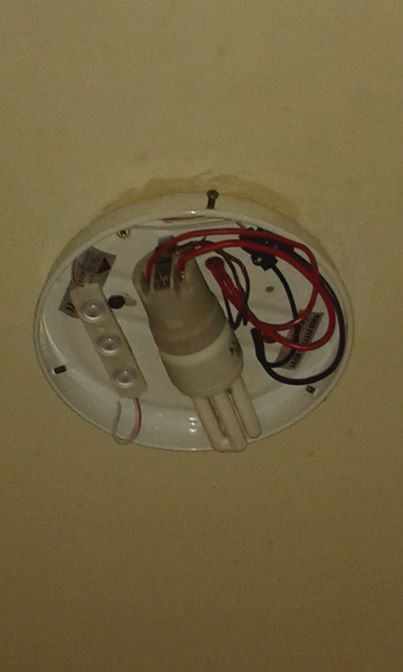
Where is `ceiling`? ceiling is located at coordinates (278, 543).